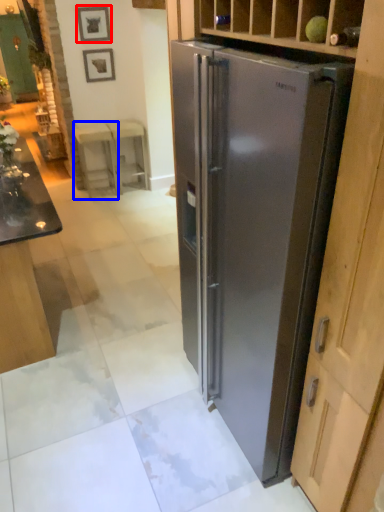
Question: Which object appears closest to the camera in this image, picture frame (highlighted by a red box) or stool (highlighted by a blue box)?

Choices:
 (A) picture frame
 (B) stool

Answer: (A)